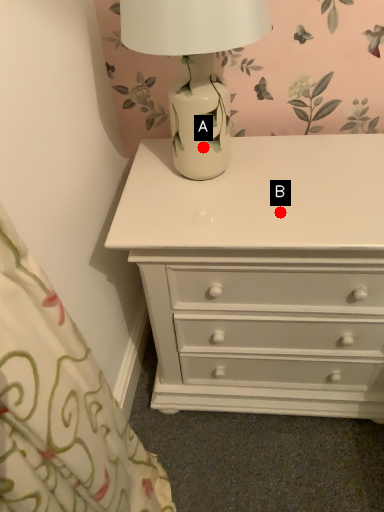
Question: Two points are circled on the image, labeled by A and B beside each circle. Which of the following is the farthest from the observer?

Choices:
 (A) A is further
 (B) B is further

Answer: (A)